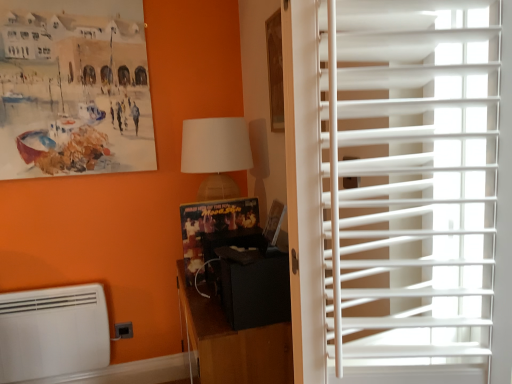
Question: Considering the relative sizes of matte white lampshade at upper center and white plastic blinds at right in the image provided, is matte white lampshade at upper center shorter than white plastic blinds at right?

Choices:
 (A) yes
 (B) no

Answer: (A)

Question: Considering the relative positions of matte white lampshade at upper center and white plastic blinds at right in the image provided, is matte white lampshade at upper center in front of white plastic blinds at right?

Choices:
 (A) no
 (B) yes

Answer: (A)

Question: Considering the relative sizes of matte white lampshade at upper center and white plastic blinds at right in the image provided, is matte white lampshade at upper center bigger than white plastic blinds at right?

Choices:
 (A) no
 (B) yes

Answer: (A)

Question: Would you say matte white lampshade at upper center contains white plastic blinds at right?

Choices:
 (A) yes
 (B) no

Answer: (B)

Question: Is matte white lampshade at upper center wider than white plastic blinds at right?

Choices:
 (A) yes
 (B) no

Answer: (B)

Question: Is white matte air conditioning at lower left to the left or to the right of black matte cabinet at center in the image?

Choices:
 (A) right
 (B) left

Answer: (B)

Question: In the image, is white matte air conditioning at lower left positioned in front of or behind black matte cabinet at center?

Choices:
 (A) behind
 (B) front

Answer: (A)

Question: In terms of height, does white matte air conditioning at lower left look taller or shorter compared to black matte cabinet at center?

Choices:
 (A) tall
 (B) short

Answer: (B)

Question: Is white matte air conditioning at lower left spatially inside black matte cabinet at center, or outside of it?

Choices:
 (A) inside
 (B) outside

Answer: (B)

Question: Considering their positions, is white plastic blinds at right located in front of or behind white matte air conditioning at lower left?

Choices:
 (A) front
 (B) behind

Answer: (A)

Question: Visually, is white plastic blinds at right positioned to the left or to the right of white matte air conditioning at lower left?

Choices:
 (A) right
 (B) left

Answer: (A)

Question: In terms of height, does white plastic blinds at right look taller or shorter compared to white matte air conditioning at lower left?

Choices:
 (A) tall
 (B) short

Answer: (A)

Question: Is white plastic blinds at right spatially inside white matte air conditioning at lower left, or outside of it?

Choices:
 (A) inside
 (B) outside

Answer: (B)

Question: From a real-world perspective, is white plastic blinds at right positioned above or below black matte cabinet at center?

Choices:
 (A) below
 (B) above

Answer: (B)

Question: From the image's perspective, is white plastic blinds at right above or below black matte cabinet at center?

Choices:
 (A) above
 (B) below

Answer: (A)